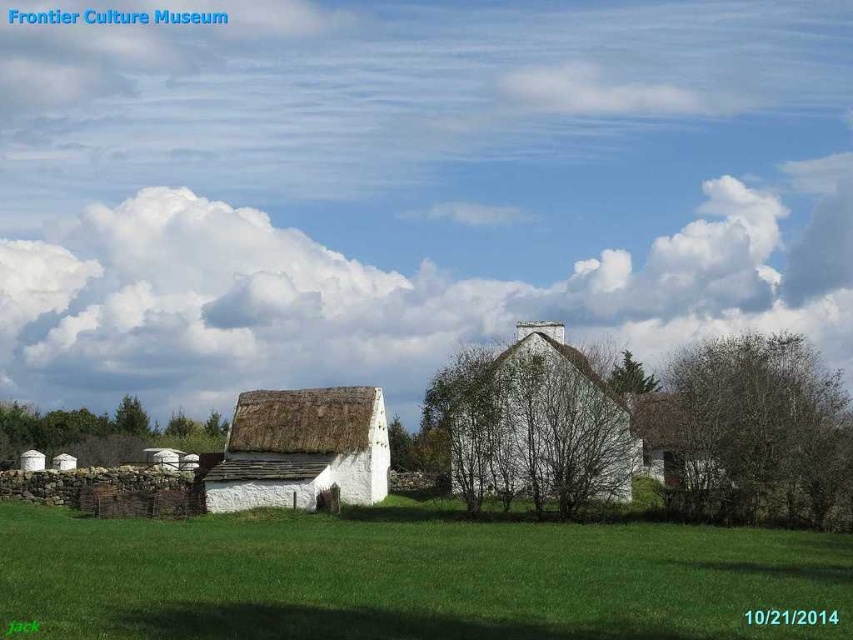
Question: Is white thatched roof hut at center in front of white thatched roof cottage at center?

Choices:
 (A) yes
 (B) no

Answer: (A)

Question: Considering the real-world distances, which object is closest to the white thatched roof hut at center?

Choices:
 (A) white thatched roof cottage at center
 (B) green grass at lower center

Answer: (A)

Question: Does green grass at lower center have a lesser width compared to white thatched roof cottage at center?

Choices:
 (A) no
 (B) yes

Answer: (A)

Question: Observing the image, what is the correct spatial positioning of green grass at lower center in reference to white thatched roof cottage at center?

Choices:
 (A) above
 (B) below

Answer: (B)

Question: Considering the real-world distances, which object is closest to the white thatched roof cottage at center?

Choices:
 (A) green grass at lower center
 (B) white thatched roof hut at center

Answer: (B)

Question: Which object is the closest to the green grass at lower center?

Choices:
 (A) white thatched roof hut at center
 (B) white thatched roof cottage at center

Answer: (A)